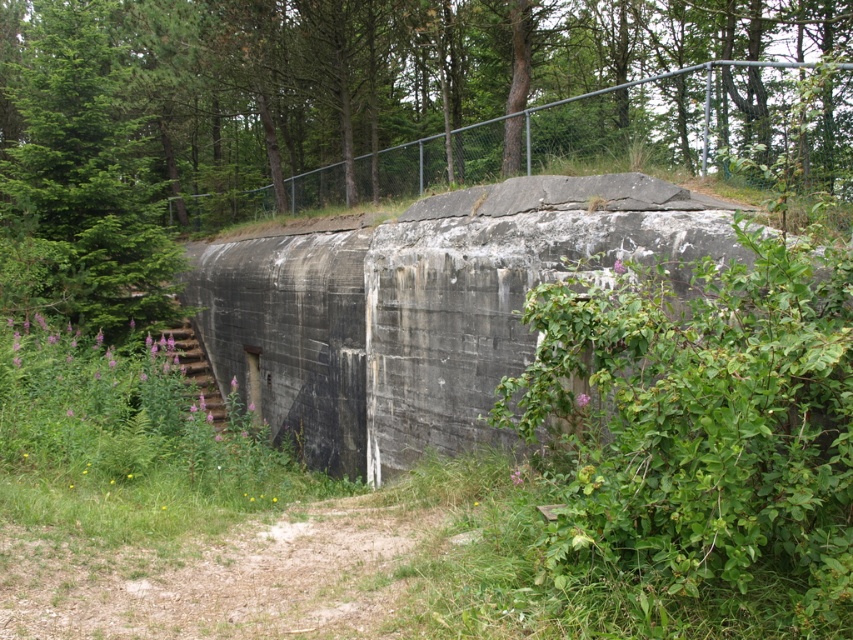
Question: Does green leafy tree at center come behind gray concrete bunker at center?

Choices:
 (A) no
 (B) yes

Answer: (B)

Question: Which point is closer to the camera?

Choices:
 (A) 67,3
 (B) 686,76
 (C) 277,192
 (D) 723,248

Answer: (D)

Question: Can you confirm if green leafy tree at center is positioned to the left of gray concrete bunker at center?

Choices:
 (A) yes
 (B) no

Answer: (A)

Question: Which of the following is the farthest from the observer?

Choices:
 (A) (83, 106)
 (B) (387, 152)
 (C) (672, 250)

Answer: (B)

Question: Can you confirm if green leafy tree at center is bigger than green chain-link fence at upper center?

Choices:
 (A) yes
 (B) no

Answer: (A)

Question: Among these objects, which one is nearest to the camera?

Choices:
 (A) gray concrete bunker at center
 (B) green chain-link fence at upper center
 (C) green leafy tree at left

Answer: (A)